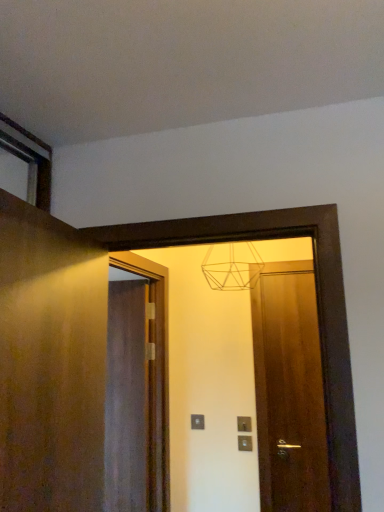
What is the approximate width of satin silver switch at center, the first electric outlet positioned from the right?

It is 1.34 inches.

This screenshot has height=512, width=384. What do you see at coordinates (50, 362) in the screenshot?
I see `wooden door at left, acting as the 1th door starting from the left` at bounding box center [50, 362].

Describe the element at coordinates (197, 422) in the screenshot. Image resolution: width=384 pixels, height=512 pixels. I see `matte gray electric outlet at center, arranged as the 1th electric outlet when viewed from the left` at that location.

How much space does matte brown door at center, positioned as the third door in left-to-right order, occupy vertically?

4.78 feet.

You are a GUI agent. You are given a task and a screenshot of the screen. Output one action in this format:
    pyautogui.click(x=<x>, y=<y>)
    Task: Click on the matte wooden mirror at center
    
    Given the screenshot: What is the action you would take?
    pyautogui.click(x=246, y=382)

How different are the orientations of wooden door at left, which is the first door from front to back, and wooden door at center, which appears as the 2th door when viewed from the right, in degrees?

They differ by 95.6 degrees in their facing directions.

How much distance is there between wooden door at left, the third door from the right, and wooden door at center, which is the 2th door in left-to-right order?

wooden door at left, the third door from the right, and wooden door at center, which is the 2th door in left-to-right order, are 4.00 feet apart from each other.

Is wooden door at left, acting as the 1th door starting from the left, oriented towards wooden door at center, the 1th door viewed from the back?

No, wooden door at left, acting as the 1th door starting from the left, does not turn towards wooden door at center, the 1th door viewed from the back.

Is wooden door at left, which is the third door in back-to-front order, to the left of wooden door at center, which is the 2th door in left-to-right order, from the viewer's perspective?

Yes.

Considering the sizes of matte gray electric outlet at center, which is the first electric outlet in back-to-front order, and satin silver switch at center, which is the second electric outlet in left-to-right order, in the image, is matte gray electric outlet at center, which is the first electric outlet in back-to-front order, wider or thinner than satin silver switch at center, which is the second electric outlet in left-to-right order,?

matte gray electric outlet at center, which is the first electric outlet in back-to-front order, is thinner than satin silver switch at center, which is the second electric outlet in left-to-right order.

Is matte gray electric outlet at center, the 2th electric outlet in the front-to-back sequence, further to camera compared to satin silver switch at center, which is counted as the 1th electric outlet, starting from the front?

Yes, it is.

Based on the photo, can you see matte gray electric outlet at center, which is the second electric outlet from right to left, touching satin silver switch at center, the first electric outlet positioned from the right?

No.

Can you confirm if matte gray electric outlet at center, which is the first electric outlet in back-to-front order, is wider than matte brown door at center, positioned as the third door in left-to-right order?

Incorrect, the width of matte gray electric outlet at center, which is the first electric outlet in back-to-front order, does not surpass that of matte brown door at center, positioned as the third door in left-to-right order.

Image resolution: width=384 pixels, height=512 pixels. Identify the location of the 2nd electric outlet below the matte brown door at center, the 2th door when ordered from back to front (from the image's perspective). (197, 422).

From the picture: How many degrees apart are the facing directions of matte gray electric outlet at center, arranged as the 1th electric outlet when viewed from the left, and matte brown door at center, the 2th door viewed from the front?

1.22 degrees.

From the image's perspective, is matte gray electric outlet at center, which is the first electric outlet in back-to-front order, beneath matte brown door at center, positioned as the third door in left-to-right order?

Yes.

Can you confirm if matte brown door at center, positioned as the third door in left-to-right order, is wider than matte wooden mirror at center?

No.

Does point (273, 360) lie in front of point (259, 273)?

Yes, it is.

From the image's perspective, between matte brown door at center, the 2th door viewed from the front, and matte wooden mirror at center, who is located below?

matte brown door at center, the 2th door viewed from the front, appears lower in the image.

From a real-world perspective, between matte brown door at center, positioned as the third door in left-to-right order, and matte wooden mirror at center, who is vertically higher?

matte wooden mirror at center.

Is wooden door at center, which appears as the third door when viewed from the front, at the right side of matte brown door at center, the 2th door when ordered from back to front?

No.

Is wooden door at center, which appears as the third door when viewed from the front, facing away from matte brown door at center, the 1th door positioned from the right?

No, wooden door at center, which appears as the third door when viewed from the front, is not facing away from matte brown door at center, the 1th door positioned from the right.

This screenshot has height=512, width=384. Find the location of `the 1st door to the left of the matte brown door at center, the 2th door when ordered from back to front, starting your count from the anchor`. the 1st door to the left of the matte brown door at center, the 2th door when ordered from back to front, starting your count from the anchor is located at coordinates (126, 399).

Is wooden door at center, which appears as the 2th door when viewed from the right, far from matte brown door at center, positioned as the third door in left-to-right order?

wooden door at center, which appears as the 2th door when viewed from the right, is near matte brown door at center, positioned as the third door in left-to-right order, not far away.

From the image's perspective, which one is positioned lower, wooden door at left, acting as the 1th door starting from the left, or matte gray electric outlet at center, which is the first electric outlet in back-to-front order?

matte gray electric outlet at center, which is the first electric outlet in back-to-front order, is shown below in the image.

Consider the image. In terms of width, does wooden door at left, acting as the 1th door starting from the left, look wider or thinner when compared to matte gray electric outlet at center, arranged as the 1th electric outlet when viewed from the left?

In the image, wooden door at left, acting as the 1th door starting from the left, appears to be wider than matte gray electric outlet at center, arranged as the 1th electric outlet when viewed from the left.

Does wooden door at left, which is the third door in back-to-front order, appear on the right side of matte gray electric outlet at center, which is the first electric outlet in back-to-front order?

No.

Could you tell me if wooden door at left, acting as the 1th door starting from the left, is facing matte gray electric outlet at center, which is the second electric outlet from right to left?

No, wooden door at left, acting as the 1th door starting from the left, does not turn towards matte gray electric outlet at center, which is the second electric outlet from right to left.

Considering the sizes of objects matte gray electric outlet at center, arranged as the 1th electric outlet when viewed from the left, and wooden door at center, the 1th door viewed from the back, in the image provided, who is smaller, matte gray electric outlet at center, arranged as the 1th electric outlet when viewed from the left, or wooden door at center, the 1th door viewed from the back,?

Smaller between the two is matte gray electric outlet at center, arranged as the 1th electric outlet when viewed from the left.

Locate an element on the screen. Image resolution: width=384 pixels, height=512 pixels. door that is the 1st object above the matte gray electric outlet at center, the 2th electric outlet in the front-to-back sequence (from a real-world perspective) is located at coordinates (126, 399).

Is matte gray electric outlet at center, which is the first electric outlet in back-to-front order, located outside wooden door at center, which is the 2th door in left-to-right order?

Yes, matte gray electric outlet at center, which is the first electric outlet in back-to-front order, is outside of wooden door at center, which is the 2th door in left-to-right order.

From a real-world perspective, which object stands above the other?

From a 3D spatial view, wooden door at center, the 1th door viewed from the back, is above.

Find the location of a particular element. door that is the 2nd object located behind the wooden door at left, which is the first door from front to back is located at coordinates (126, 399).

What are the coordinates of `electric outlet below the matte gray electric outlet at center, which is the first electric outlet in back-to-front order (from a real-world perspective)` in the screenshot? It's located at (244, 424).

Which object lies nearer to the anchor point wooden door at left, acting as the 1th door starting from the left, satin silver switch at center, the first electric outlet positioned from the right, or matte gray electric outlet at center, which is the second electric outlet from right to left?

matte gray electric outlet at center, which is the second electric outlet from right to left, lies closer to wooden door at left, acting as the 1th door starting from the left, than the other object.

From the image, which object appears to be farther from satin silver switch at center, which is counted as the 1th electric outlet, starting from the front, matte brown door at center, the 1th door positioned from the right, or wooden door at center, which is the 2th door in left-to-right order?

wooden door at center, which is the 2th door in left-to-right order, is positioned further to the anchor satin silver switch at center, which is counted as the 1th electric outlet, starting from the front.

When comparing their distances from matte brown door at center, the 1th door positioned from the right, does matte wooden mirror at center or wooden door at center, which appears as the third door when viewed from the front, seem further?

wooden door at center, which appears as the third door when viewed from the front, is positioned further to the anchor matte brown door at center, the 1th door positioned from the right.

Looking at the image, which one is located further to matte brown door at center, the 1th door positioned from the right, wooden door at center, the 1th door viewed from the back, or satin silver switch at center, which is counted as the 1th electric outlet, starting from the front?

wooden door at center, the 1th door viewed from the back.

In the scene shown: Estimate the real-world distances between objects in this image. Which object is further from wooden door at left, which is the third door in back-to-front order, matte gray electric outlet at center, arranged as the 1th electric outlet when viewed from the left, or satin silver switch at center, the first electric outlet positioned from the right?

satin silver switch at center, the first electric outlet positioned from the right, is positioned further to the anchor wooden door at left, which is the third door in back-to-front order.

From the image, which object appears to be nearer to matte gray electric outlet at center, which is the second electric outlet from right to left, matte wooden mirror at center or wooden door at left, acting as the 1th door starting from the left?

The object closer to matte gray electric outlet at center, which is the second electric outlet from right to left, is matte wooden mirror at center.

Estimate the real-world distances between objects in this image. Which object is further from matte gray electric outlet at center, arranged as the 1th electric outlet when viewed from the left, wooden door at left, which is the first door from front to back, or matte brown door at center, positioned as the third door in left-to-right order?

Among the two, wooden door at left, which is the first door from front to back, is located further to matte gray electric outlet at center, arranged as the 1th electric outlet when viewed from the left.

Based on the photo, looking at the image, which one is located closer to matte wooden mirror at center, wooden door at center, the 1th door viewed from the back, or wooden door at left, the third door from the right?

wooden door at center, the 1th door viewed from the back.

Locate an element on the screen. The width and height of the screenshot is (384, 512). electric outlet between matte wooden mirror at center and matte gray electric outlet at center, the 2th electric outlet in the front-to-back sequence, along the z-axis is located at coordinates (244, 424).

This screenshot has height=512, width=384. What are the coordinates of `mirror located between wooden door at left, which is the third door in back-to-front order, and satin silver switch at center, which is counted as the 1th electric outlet, starting from the front, in the depth direction` in the screenshot? It's located at (246, 382).

At what (x,y) coordinates should I click in order to perform the action: click on electric outlet situated between matte gray electric outlet at center, the 2th electric outlet in the front-to-back sequence, and matte brown door at center, positioned as the third door in left-to-right order, from left to right. Please return your answer as a coordinate pair (x, y). The height and width of the screenshot is (512, 384). Looking at the image, I should click on (244, 424).

Identify the location of door located between wooden door at left, which is the third door in back-to-front order, and wooden door at center, the 1th door viewed from the back, in the depth direction. (289, 391).